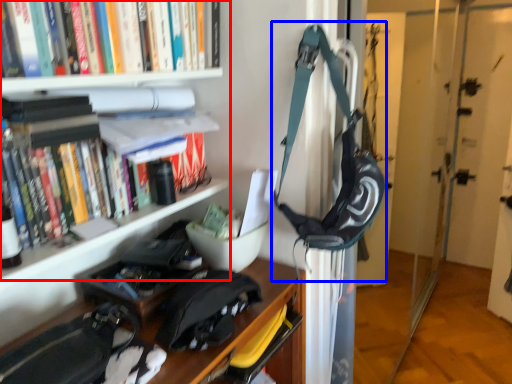
Question: Which object is further to the camera taking this photo, bookcase (highlighted by a red box) or shoulder bag (highlighted by a blue box)?

Choices:
 (A) bookcase
 (B) shoulder bag

Answer: (B)